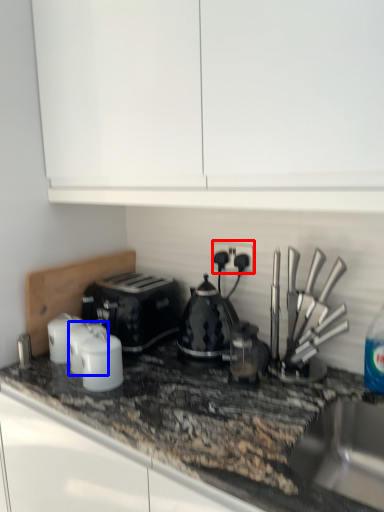
Question: Which object appears closest to the camera in this image, electric outlet (highlighted by a red box) or kitchen appliance (highlighted by a blue box)?

Choices:
 (A) electric outlet
 (B) kitchen appliance

Answer: (B)